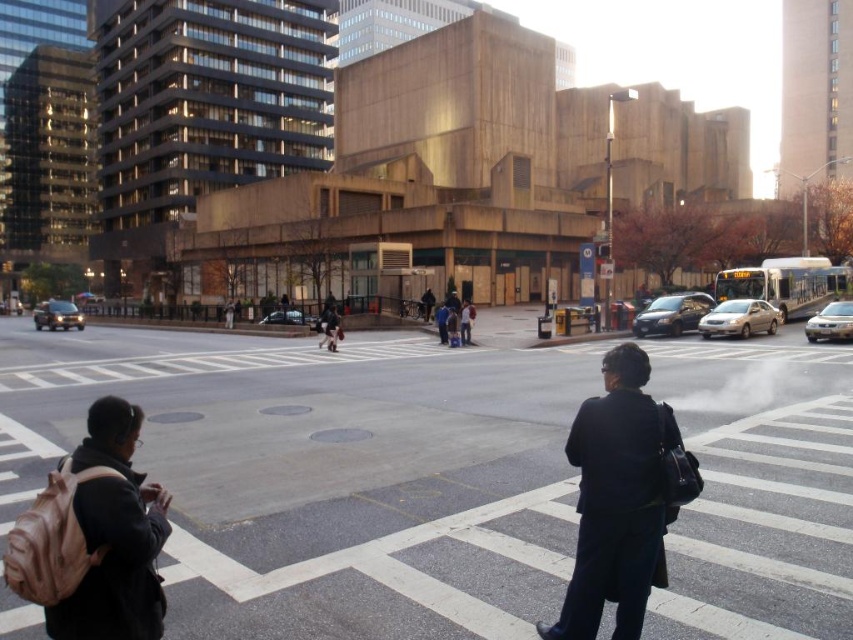
You are a delivery person standing at the edge of the dark gray asphalt at center and need to hand a package to the dark blue coat at center. Can you reach them without moving from your current position?

The dark gray asphalt at center is further to the viewer than dark blue coat at center, meaning the dark blue coat at center is closer to you. Since you are on the dark gray asphalt at center, you can reach the dark blue coat at center without moving because they are closer.

You are a delivery person who needs to place a small package on the ground. You see the dark gray asphalt at center and the beige fabric backpack at lower left in the scene. Which surface would be more suitable for placing the package?

The dark gray asphalt at center is larger in size than the beige fabric backpack at lower left, so the asphalt would provide a more stable and suitable surface for placing the small package.